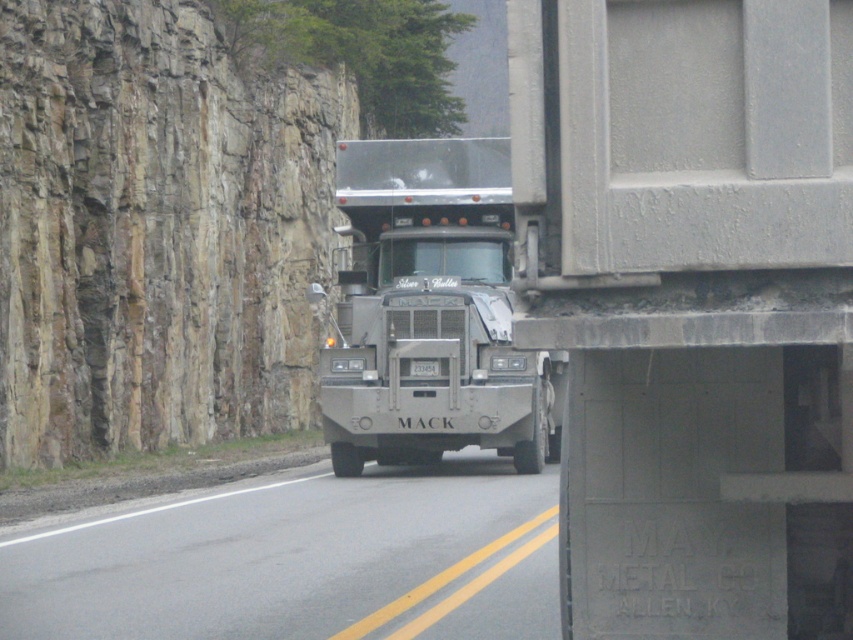
Question: Does gray concrete trailer truck at right have a lesser width compared to gray asphalt road at center?

Choices:
 (A) yes
 (B) no

Answer: (A)

Question: Which object appears farthest from the camera in this image?

Choices:
 (A) matte gray truck at center
 (B) gray concrete trailer truck at right
 (C) gray asphalt road at center

Answer: (A)

Question: Which of the following is the closest to the observer?

Choices:
 (A) click(x=675, y=564)
 (B) click(x=550, y=637)

Answer: (A)

Question: Which of these objects is positioned farthest from the gray concrete trailer truck at right?

Choices:
 (A) gray asphalt road at center
 (B) matte gray truck at center

Answer: (B)

Question: Can you confirm if gray concrete trailer truck at right is smaller than gray asphalt road at center?

Choices:
 (A) no
 (B) yes

Answer: (B)

Question: Is gray concrete trailer truck at right closer to the viewer compared to matte gray truck at center?

Choices:
 (A) yes
 (B) no

Answer: (A)